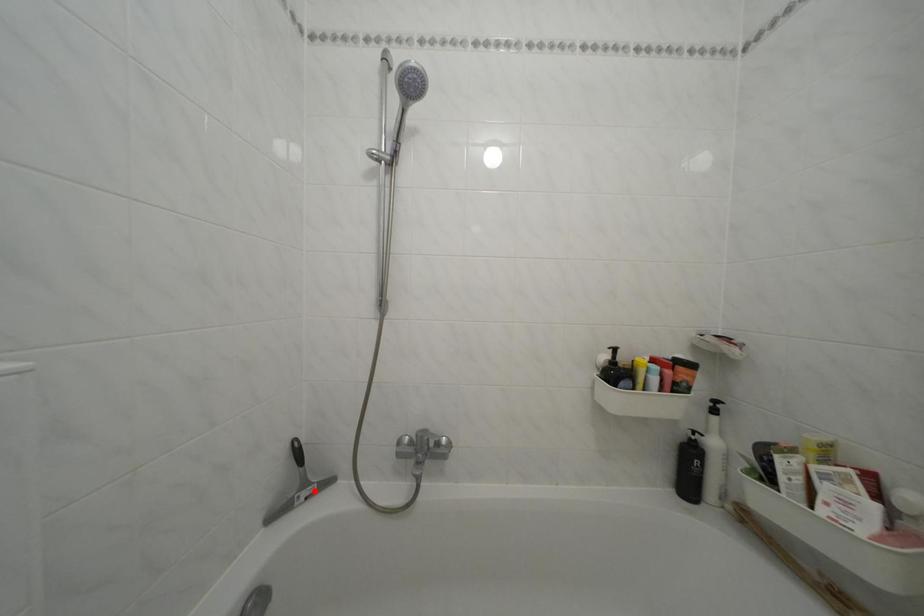
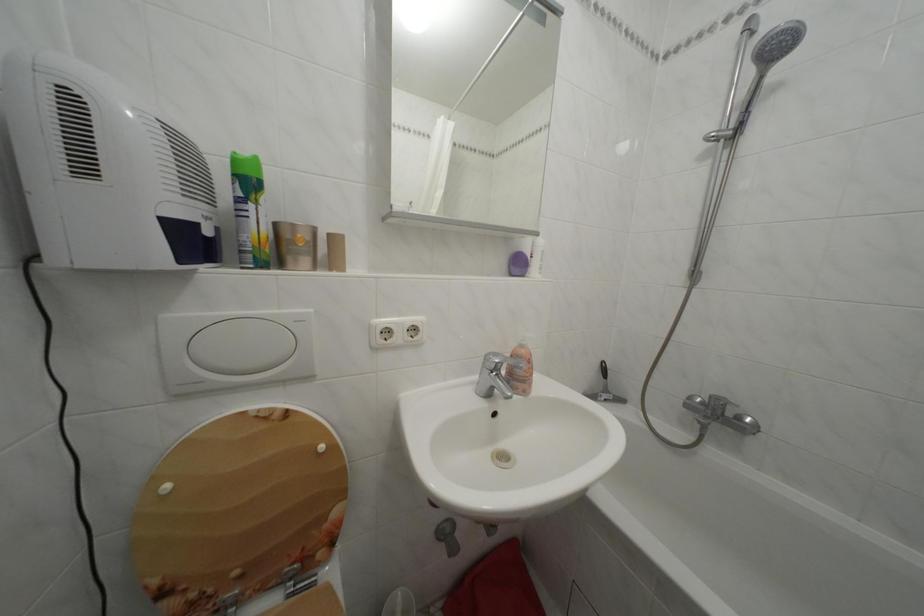
Question: I am providing you with two images of the same scene from different viewpoints. A red point is shown in image1. For the corresponding object point in image2, is it positioned nearer or farther from the camera?

Choices:
 (A) Nearer
 (B) Farther

Answer: (B)